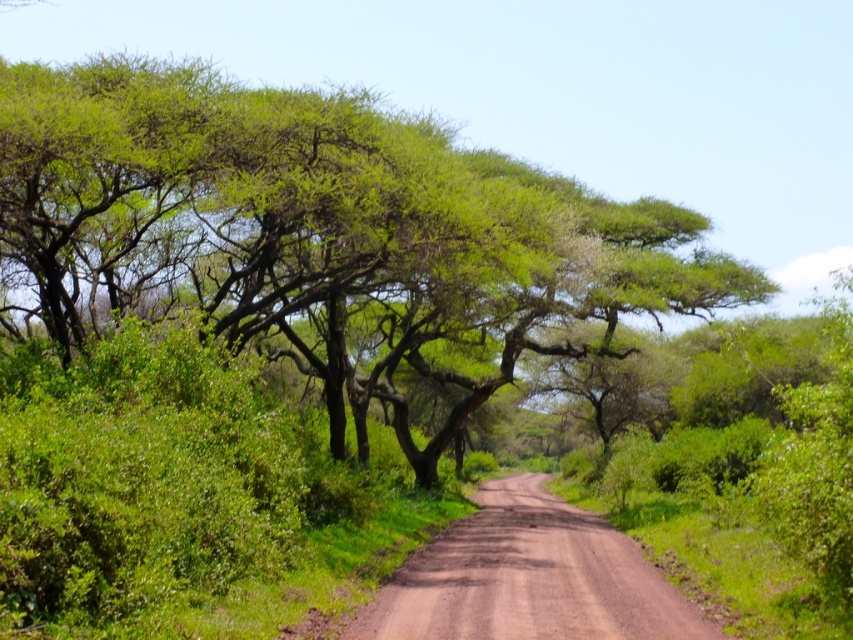
You are a hiker trying to navigate through the green leafy tree at center and the brown dusty road at center. Which object would you need to look up to see properly?

The green leafy tree at center is much taller than the brown dusty road at center, so you would need to look up to see the green leafy tree at center properly.

You are a hiker standing at the start of the dirt road and want to reach the end of the road. Which object, the green leafy tree at center or the brown dusty road at center, will you encounter first as you begin walking forward?

You will encounter the green leafy tree at center first because it is closer to you than the brown dusty road at center, which is further away.